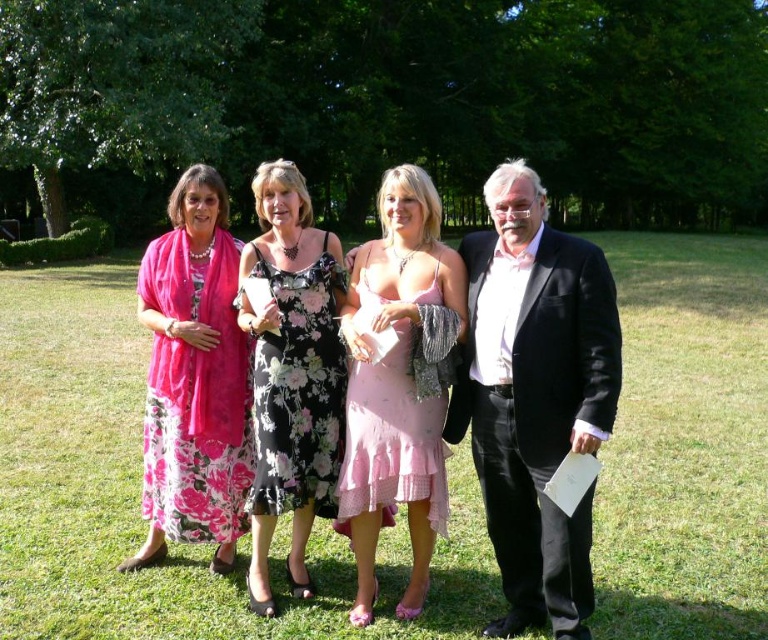
Is point (356, 568) closer to camera compared to point (495, 332)?

No.

Who is positioned more to the right, pink floral dress at center or black satin suit at right?

Positioned to the right is black satin suit at right.

Locate an element on the screen. The height and width of the screenshot is (640, 768). pink floral dress at center is located at coordinates (533, 394).

Image resolution: width=768 pixels, height=640 pixels. Identify the location of pink floral dress at center. (533, 394).

Is pink floral dress at center above pink chiffon dress at center?

Yes, pink floral dress at center is above pink chiffon dress at center.

The width and height of the screenshot is (768, 640). I want to click on pink floral dress at center, so click(533, 394).

Between point (584, 586) and point (313, 387), which one is positioned behind?

The point (313, 387) is behind.

Is point (530, 358) farther from camera compared to point (255, 456)?

No.

Is point (477, 420) closer to camera compared to point (323, 364)?

Yes, point (477, 420) is closer to viewer.

Locate an element on the screen. The width and height of the screenshot is (768, 640). pink floral dress at center is located at coordinates 533,394.